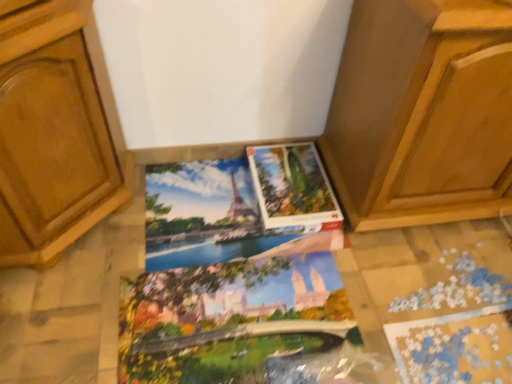
Question: Is matte paper coloring book at center, marked as the first coloring book in a bottom-to-top arrangement, wider or thinner than matte cardboard puzzle at center?

Choices:
 (A) wide
 (B) thin

Answer: (A)

Question: Does point (155, 306) appear closer or farther from the camera than point (318, 195)?

Choices:
 (A) closer
 (B) farther

Answer: (A)

Question: Estimate the real-world distances between objects in this image. Which object is farther from the wooden cabinet at center?

Choices:
 (A) matte paper coloring book at center, marked as the first coloring book in a bottom-to-top arrangement
 (B) matte cardboard puzzle at center
 (C) matte paper coloring book at center, placed as the 2th coloring book when sorted from bottom to top

Answer: (A)

Question: Which of these objects is positioned closest to the matte paper coloring book at center, positioned as the 2th coloring book in top-to-bottom order?

Choices:
 (A) wooden cabinet at center
 (B) matte paper coloring book at center, placed as the 2th coloring book when sorted from bottom to top
 (C) matte cardboard puzzle at center

Answer: (B)